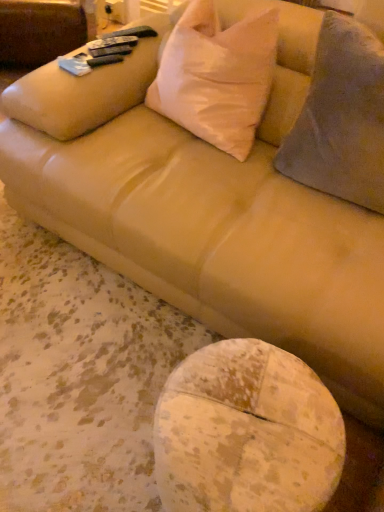
Question: Is white matte pillow at upper center, the first throw pillow from the left, further to camera compared to speckled wood table at lower center?

Choices:
 (A) no
 (B) yes

Answer: (B)

Question: Would you say white matte pillow at upper center, the 2th throw pillow in the right-to-left sequence, contains speckled wood table at lower center?

Choices:
 (A) no
 (B) yes

Answer: (A)

Question: Is white matte pillow at upper center, the first throw pillow from the left, aimed at speckled wood table at lower center?

Choices:
 (A) no
 (B) yes

Answer: (A)

Question: From the image's perspective, is white matte pillow at upper center, the 2th throw pillow in the right-to-left sequence, under speckled wood table at lower center?

Choices:
 (A) no
 (B) yes

Answer: (A)

Question: Is white matte pillow at upper center, the first throw pillow from the left, to the right of speckled wood table at lower center from the viewer's perspective?

Choices:
 (A) no
 (B) yes

Answer: (A)

Question: Is speckled wood table at lower center at the back of white matte pillow at upper center, the 2th throw pillow in the right-to-left sequence?

Choices:
 (A) yes
 (B) no

Answer: (B)

Question: From a real-world perspective, is speckled wood table at lower center physically below white matte pillow at upper center, the first throw pillow from the left?

Choices:
 (A) no
 (B) yes

Answer: (B)

Question: From the image's perspective, is speckled wood table at lower center above white matte pillow at upper center, the 2th throw pillow in the right-to-left sequence?

Choices:
 (A) no
 (B) yes

Answer: (A)

Question: Is speckled wood table at lower center not within white matte pillow at upper center, the 2th throw pillow in the right-to-left sequence?

Choices:
 (A) no
 (B) yes

Answer: (B)

Question: From a real-world perspective, is speckled wood table at lower center physically above white matte pillow at upper center, the first throw pillow from the left?

Choices:
 (A) no
 (B) yes

Answer: (A)

Question: Is speckled wood table at lower center aimed at white matte pillow at upper center, the 2th throw pillow in the right-to-left sequence?

Choices:
 (A) no
 (B) yes

Answer: (A)

Question: Is speckled wood table at lower center surrounding white matte pillow at upper center, the first throw pillow from the left?

Choices:
 (A) no
 (B) yes

Answer: (A)

Question: From a real-world perspective, is gray fuzzy throw pillow at right, positioned as the first throw pillow in right-to-left order, positioned under white matte pillow at upper center, the 2th throw pillow in the right-to-left sequence, based on gravity?

Choices:
 (A) no
 (B) yes

Answer: (A)